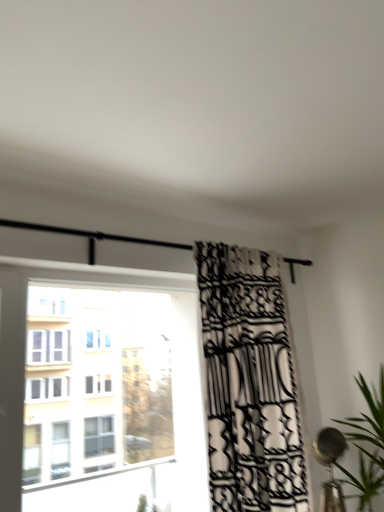
Image resolution: width=384 pixels, height=512 pixels. What do you see at coordinates (249, 383) in the screenshot?
I see `black and white patterned curtain at center` at bounding box center [249, 383].

Where is `black curtain at upper center`? black curtain at upper center is located at coordinates (92, 237).

In order to click on black and white patterned curtain at center in this screenshot , I will do `click(249, 383)`.

From the image's perspective, between black and white patterned curtain at center and black curtain at upper center, which one is located above?

black curtain at upper center is shown above in the image.

Is black and white patterned curtain at center inside the boundaries of black curtain at upper center, or outside?

black and white patterned curtain at center lies outside black curtain at upper center.

Can you confirm if black and white patterned curtain at center is wider than black curtain at upper center?

Indeed, black and white patterned curtain at center has a greater width compared to black curtain at upper center.

Is black and white patterned curtain at center shorter than black curtain at upper center?

In fact, black and white patterned curtain at center may be taller than black curtain at upper center.

From the picture: Which of these two, green leafy plant at right or transparent glass window at left, is thinner?

Thinner between the two is transparent glass window at left.

How many degrees apart are the facing directions of green leafy plant at right and transparent glass window at left?

There is a 88.8-degree angle between the facing directions of green leafy plant at right and transparent glass window at left.

Which is closer to the camera, (381, 409) or (76, 447)?

Positioned in front is point (381, 409).

Locate an element on the screen. This screenshot has height=512, width=384. window located above the green leafy plant at right (from a real-world perspective) is located at coordinates (100, 388).

Based on the photo, from a real-world perspective, is black and white patterned curtain at center located higher than green leafy plant at right?

Yes, from a real-world perspective, black and white patterned curtain at center is above green leafy plant at right.

Does point (260, 391) appear closer or farther from the camera than point (367, 504)?

Point (260, 391).

Which of these two, black and white patterned curtain at center or green leafy plant at right, stands taller?

black and white patterned curtain at center is taller.

Consider the image. Does black and white patterned curtain at center contain green leafy plant at right?

Actually, green leafy plant at right is outside black and white patterned curtain at center.

Based on the photo, how many degrees apart are the facing directions of black curtain at upper center and transparent glass window at left?

The angle between the facing direction of black curtain at upper center and the facing direction of transparent glass window at left is 8.54e-05 degrees.

Looking at the image, does black curtain at upper center seem bigger or smaller compared to transparent glass window at left?

black curtain at upper center is smaller than transparent glass window at left.

Is black curtain at upper center placed right next to transparent glass window at left?

black curtain at upper center and transparent glass window at left are clearly separated.

Image resolution: width=384 pixels, height=512 pixels. In order to click on houseplant below the transparent glass window at left (from a real-world perspective) in this screenshot , I will do `click(366, 445)`.

Can you confirm if transparent glass window at left is wider than green leafy plant at right?

No, transparent glass window at left is not wider than green leafy plant at right.

Consider the image. Is transparent glass window at left taller than green leafy plant at right?

Indeed, transparent glass window at left has a greater height compared to green leafy plant at right.

From the image's perspective, is black curtain at upper center located beneath green leafy plant at right?

No, from the image's perspective, black curtain at upper center is not below green leafy plant at right.

In the image, is black curtain at upper center positioned in front of or behind green leafy plant at right?

black curtain at upper center is positioned farther from the viewer than green leafy plant at right.

Can you tell me how much black curtain at upper center and green leafy plant at right differ in facing direction?

The facing directions of black curtain at upper center and green leafy plant at right are 88.8 degrees apart.

Between transparent glass window at left and black and white patterned curtain at center, which one has more height?

With more height is black and white patterned curtain at center.

From a real-world perspective, relative to black and white patterned curtain at center, is transparent glass window at left vertically above or below?

transparent glass window at left is situated lower than black and white patterned curtain at center in the real world.

Does transparent glass window at left turn towards black and white patterned curtain at center?

No, transparent glass window at left does not turn towards black and white patterned curtain at center.

Identify the location of balcony that appears on the left of black and white patterned curtain at center. This screenshot has height=512, width=384. (92, 237).

You are a GUI agent. You are given a task and a screenshot of the screen. Output one action in this format:
    pyautogui.click(x=<x>, y=<y>)
    Task: Click on the window that appears above the green leafy plant at right (from a real-world perspective)
    The width and height of the screenshot is (384, 512).
    Given the screenshot: What is the action you would take?
    pyautogui.click(x=100, y=388)

From the image, which object appears to be nearer to transparent glass window at left, green leafy plant at right or black curtain at upper center?

The object closer to transparent glass window at left is green leafy plant at right.

Based on the photo, looking at the image, which one is located further to black curtain at upper center, green leafy plant at right or transparent glass window at left?

transparent glass window at left is positioned further to the anchor black curtain at upper center.

Estimate the real-world distances between objects in this image. Which object is further from black curtain at upper center, black and white patterned curtain at center or transparent glass window at left?

transparent glass window at left is further to black curtain at upper center.

When comparing their distances from green leafy plant at right, does black and white patterned curtain at center or transparent glass window at left seem further?

transparent glass window at left lies further to green leafy plant at right than the other object.

When comparing their distances from transparent glass window at left, does black and white patterned curtain at center or green leafy plant at right seem further?

green leafy plant at right.

Looking at the image, which one is located further to green leafy plant at right, black curtain at upper center or transparent glass window at left?

Among the two, transparent glass window at left is located further to green leafy plant at right.

Looking at the image, which one is located further to black and white patterned curtain at center, black curtain at upper center or green leafy plant at right?

black curtain at upper center lies further to black and white patterned curtain at center than the other object.

Based on their spatial positions, is green leafy plant at right or transparent glass window at left closer to black and white patterned curtain at center?

The object closer to black and white patterned curtain at center is green leafy plant at right.

In order to click on balcony between transparent glass window at left and green leafy plant at right in this screenshot , I will do `click(92, 237)`.

Locate an element on the screen. The image size is (384, 512). curtain situated between transparent glass window at left and green leafy plant at right from left to right is located at coordinates (249, 383).

Locate an element on the screen. Image resolution: width=384 pixels, height=512 pixels. curtain between black curtain at upper center and transparent glass window at left vertically is located at coordinates (249, 383).

You are a GUI agent. You are given a task and a screenshot of the screen. Output one action in this format:
    pyautogui.click(x=<x>, y=<y>)
    Task: Click on the curtain between black curtain at upper center and green leafy plant at right in the vertical direction
    This screenshot has width=384, height=512.
    Given the screenshot: What is the action you would take?
    pyautogui.click(x=249, y=383)